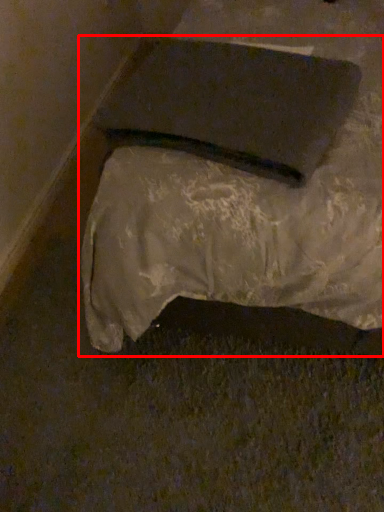
Question: From the image's perspective, where is furniture (annotated by the red box) located relative to pad?

Choices:
 (A) above
 (B) below

Answer: (A)